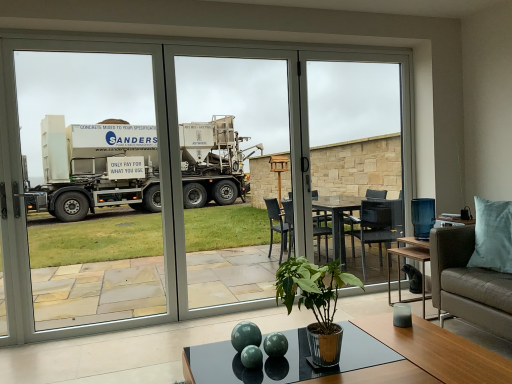
Question: Does brown leather couch at lower right have a lesser width compared to transparent glass door at center, the first screen door viewed from the right?

Choices:
 (A) yes
 (B) no

Answer: (B)

Question: From the image's perspective, does brown leather couch at lower right appear lower than transparent glass door at center, the first screen door viewed from the right?

Choices:
 (A) no
 (B) yes

Answer: (B)

Question: Does brown leather couch at lower right have a larger size compared to transparent glass door at center, the first screen door viewed from the right?

Choices:
 (A) no
 (B) yes

Answer: (B)

Question: Is brown leather couch at lower right in front of transparent glass door at center, the second screen door positioned from the left?

Choices:
 (A) no
 (B) yes

Answer: (B)

Question: Can you confirm if brown leather couch at lower right is shorter than transparent glass door at center, the first screen door viewed from the right?

Choices:
 (A) no
 (B) yes

Answer: (B)

Question: From the image's perspective, does brown leather couch at lower right appear higher than transparent glass door at center, the first screen door viewed from the right?

Choices:
 (A) no
 (B) yes

Answer: (A)

Question: Considering the relative sizes of transparent glass door at center and green glossy plant at center in the image provided, is transparent glass door at center taller than green glossy plant at center?

Choices:
 (A) no
 (B) yes

Answer: (B)

Question: Is transparent glass door at center facing away from green glossy plant at center?

Choices:
 (A) no
 (B) yes

Answer: (B)

Question: Does transparent glass door at center appear on the right side of green glossy plant at center?

Choices:
 (A) yes
 (B) no

Answer: (B)

Question: Considering the relative sizes of transparent glass door at center and green glossy plant at center in the image provided, is transparent glass door at center smaller than green glossy plant at center?

Choices:
 (A) yes
 (B) no

Answer: (B)

Question: From the image's perspective, is transparent glass door at center on green glossy plant at center?

Choices:
 (A) no
 (B) yes

Answer: (B)

Question: Is transparent glass door at center positioned in front of green glossy plant at center?

Choices:
 (A) no
 (B) yes

Answer: (A)

Question: From the image's perspective, is green glossy plant at center under transparent glass table at center?

Choices:
 (A) no
 (B) yes

Answer: (B)